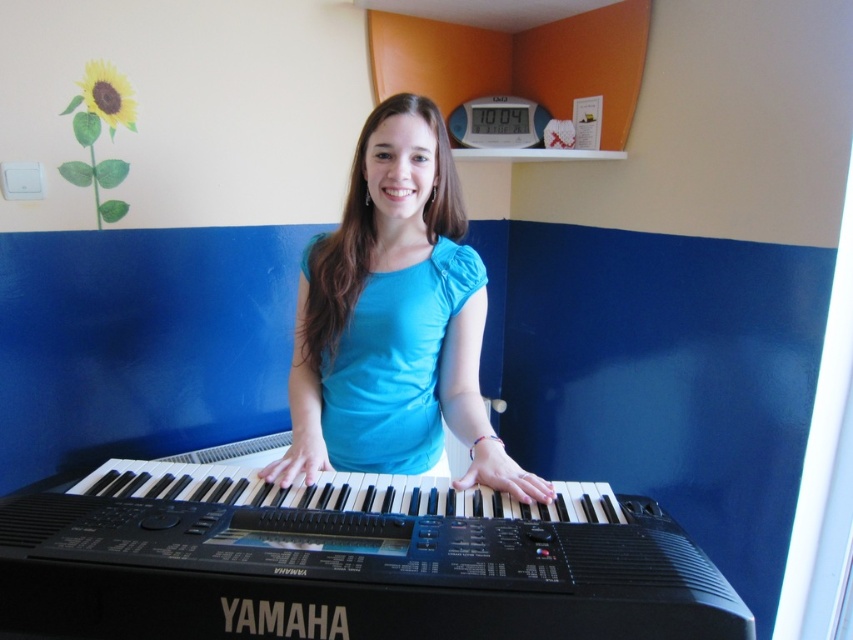
You are standing in the room and want to place a small plant between the two points, point (358, 589) and point (405, 147). Which point should the plant be closer to in order to be closer to the viewer?

The plant should be closer to point (358, 589) because it is closer to the viewer than point (405, 147).

You are a photographer setting up for a portrait shoot. You notice the black plastic piano at center and the blue fabric shirt at center. Which object should you focus on if you want to capture the smaller one in detail?

The black plastic piano at center is smaller than the blue fabric shirt at center, so you should focus on the black plastic piano at center to capture the smaller one in detail.

You are a photographer setting up for a portrait. The subject is standing in front of a keyboard. You need to ensure there is at least 30 centimeters between the black plastic piano at center and the blue fabric shirt at center to avoid overlapping in the photo. Based on the scene description, will this requirement be met?

The black plastic piano at center and blue fabric shirt at center are 30.13 centimeters apart, which is just over the required 30 centimeters. Therefore, the requirement is barely met, and there should be no overlapping in the photo.